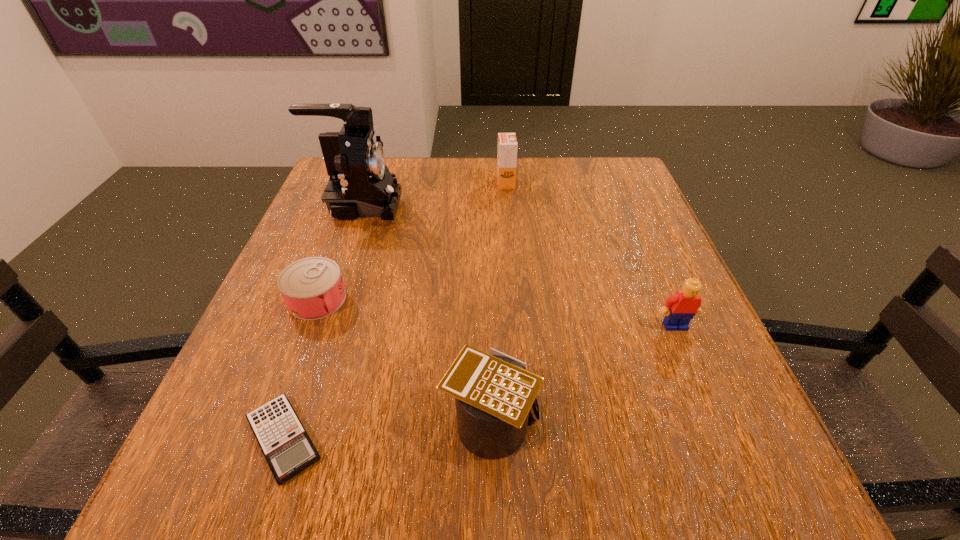
The image size is (960, 540). Find the location of `vacant space located on the left of the taller calculator`. vacant space located on the left of the taller calculator is located at coordinates (287, 419).

The height and width of the screenshot is (540, 960). I want to click on free space located 0.220m on the front of the can, so tap(266, 435).

This screenshot has height=540, width=960. In order to click on free space located 0.180m on the back of the shorter calculator in this screenshot , I will do `click(327, 312)`.

You are a GUI agent. You are given a task and a screenshot of the screen. Output one action in this format:
    pyautogui.click(x=<x>, y=<y>)
    Task: Click on the camcorder that is at the far edge
    The image size is (960, 540).
    Given the screenshot: What is the action you would take?
    pyautogui.click(x=360, y=185)

Image resolution: width=960 pixels, height=540 pixels. Identify the location of orange juice that is at the far edge. (507, 143).

The image size is (960, 540). In order to click on camcorder present at the left edge in this screenshot , I will do `click(360, 185)`.

Identify the location of can that is at the left edge. This screenshot has width=960, height=540. (312, 288).

Find the location of a particular element. The image size is (960, 540). calculator that is at the left edge is located at coordinates (288, 449).

Locate an element on the screen. The height and width of the screenshot is (540, 960). object present at the right edge is located at coordinates [679, 309].

I want to click on object located in the far left corner section of the desktop, so click(x=360, y=185).